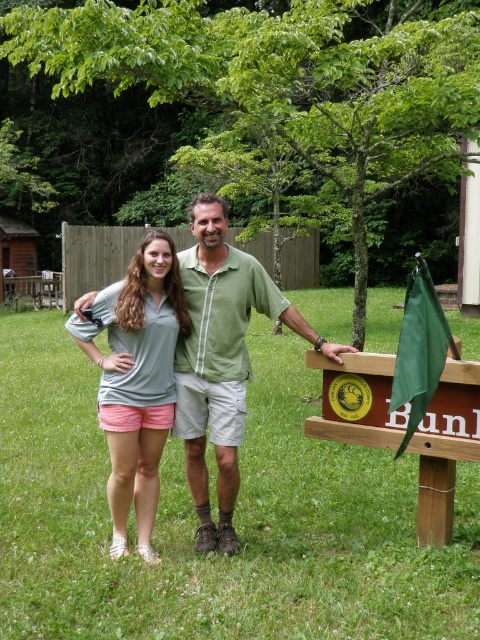
Which is more to the left, green grass at center or matte gray shirt at center?

From the viewer's perspective, matte gray shirt at center appears more on the left side.

Is point (463, 561) positioned behind point (117, 481)?

No, it is in front of (117, 481).

Image resolution: width=480 pixels, height=640 pixels. I want to click on green grass at center, so click(233, 518).

Who is lower down, green matte shirt at center or matte gray shirt at center?

matte gray shirt at center is below.

Is green matte shirt at center smaller than matte gray shirt at center?

Incorrect, green matte shirt at center is not smaller in size than matte gray shirt at center.

Which is in front, point (223, 362) or point (165, 237)?

Point (165, 237) is in front.

At what (x,y) coordinates should I click in order to perform the action: click on green matte shirt at center. Please return your answer as a coordinate pair (x, y). This screenshot has width=480, height=640. Looking at the image, I should click on pos(222,360).

Is green grass at center behind green matte shirt at center?

That is False.

Is green grass at center below green matte shirt at center?

Yes, green grass at center is below green matte shirt at center.

Does point (387, 545) lie behind point (192, 280)?

No, it is in front of (192, 280).

In order to click on green grass at center in this screenshot , I will do `click(233, 518)`.